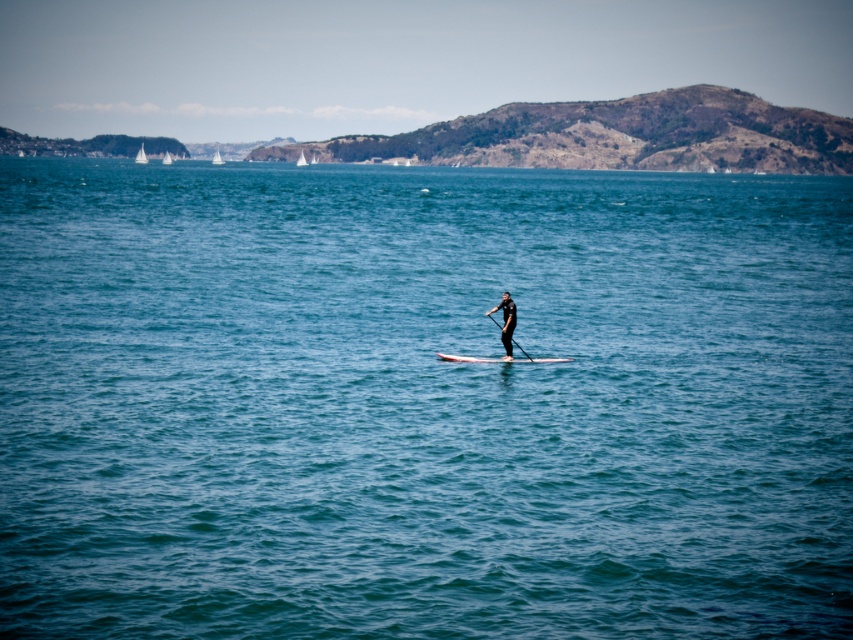
Question: Which object is farther from the camera taking this photo?

Choices:
 (A) white glossy paddleboard at center
 (B) white foam surfboard at center

Answer: (B)

Question: Can you confirm if white foam surfboard at center is positioned above white glossy paddleboard at center?

Choices:
 (A) yes
 (B) no

Answer: (B)

Question: Which point is closer to the camera?

Choices:
 (A) click(519, 348)
 (B) click(560, 358)

Answer: (A)

Question: Which object is farther from the camera taking this photo?

Choices:
 (A) white foam surfboard at center
 (B) white glossy paddleboard at center

Answer: (A)

Question: Can you confirm if white foam surfboard at center is positioned to the left of white glossy paddleboard at center?

Choices:
 (A) yes
 (B) no

Answer: (A)

Question: Does white foam surfboard at center appear under white glossy paddleboard at center?

Choices:
 (A) no
 (B) yes

Answer: (B)